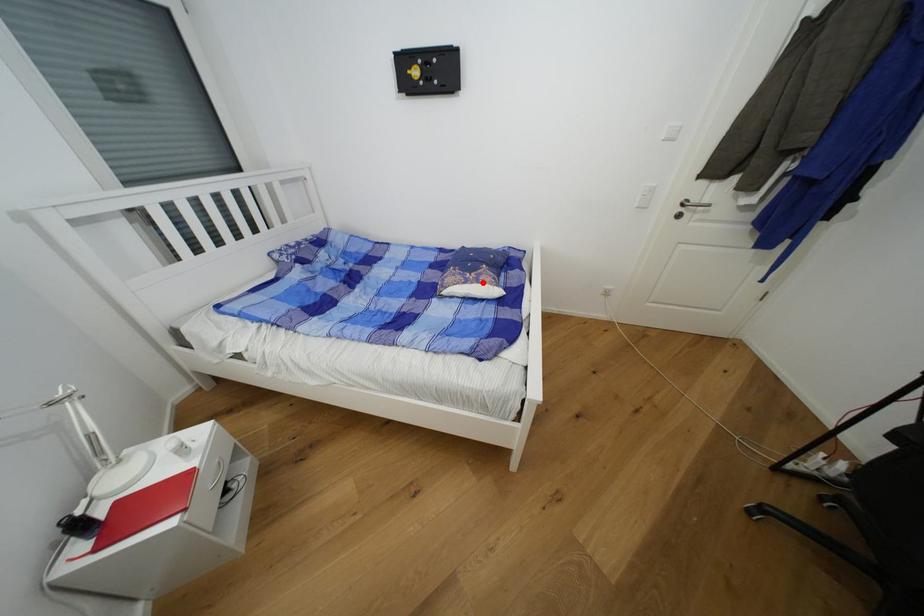
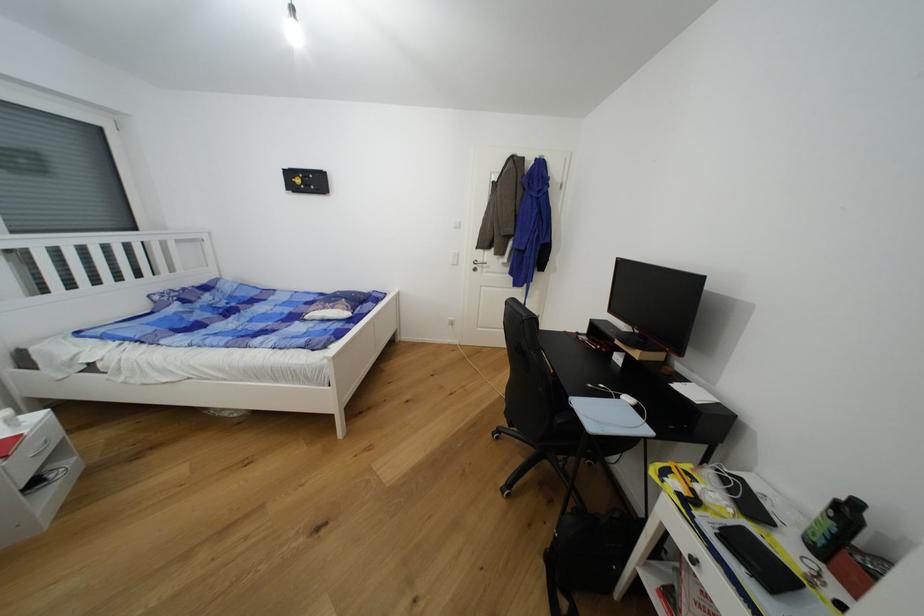
In the second image, find the point that corresponds to the highlighted location in the first image.

(337, 310)